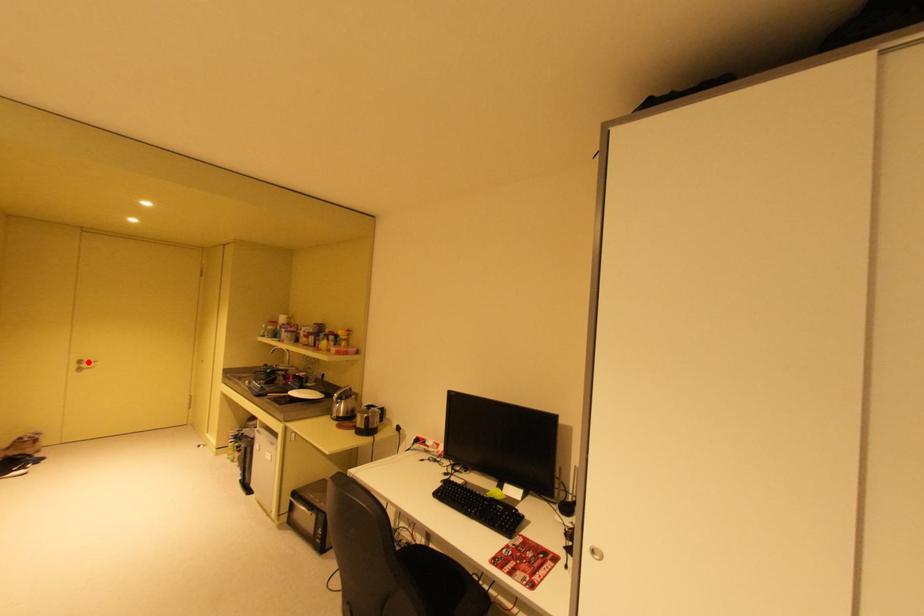
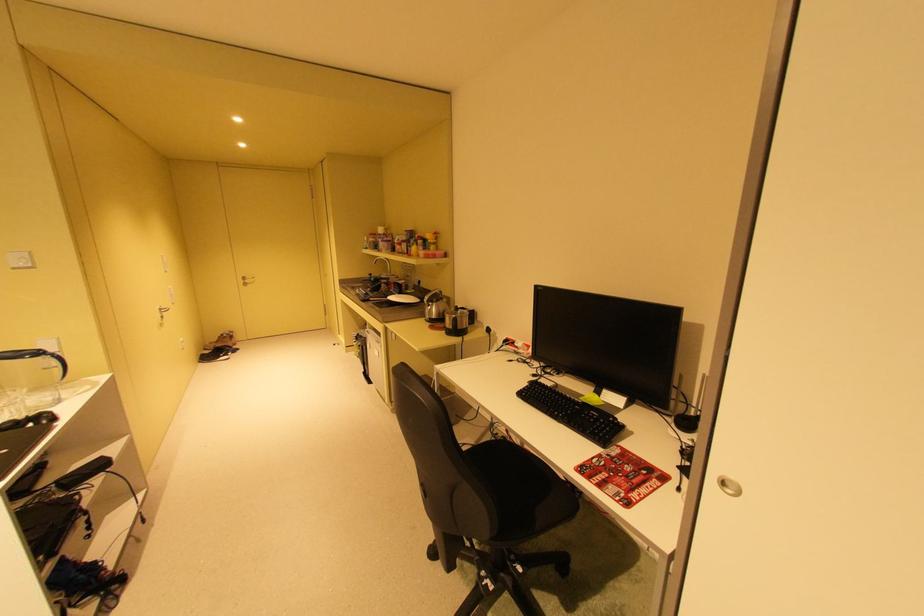
Question: I am providing you with two images of the same scene from different viewpoints. A red point is shown in image1. For the corresponding object point in image2, is it positioned nearer or farther from the camera?

Choices:
 (A) Nearer
 (B) Farther

Answer: (A)